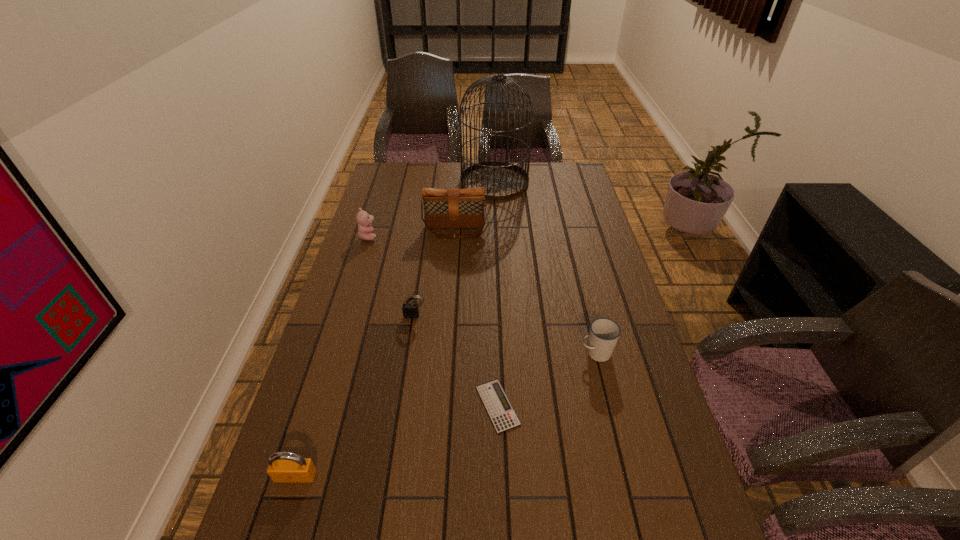
Image resolution: width=960 pixels, height=540 pixels. Identify the location of object present at the far edge. (501, 180).

Where is `teddy bear that is at the left edge`? The width and height of the screenshot is (960, 540). teddy bear that is at the left edge is located at coordinates (x=365, y=231).

Find the location of a particular element. padlock that is at the left edge is located at coordinates (284, 467).

Find the location of a particular element. The height and width of the screenshot is (540, 960). object that is positioned at the right edge is located at coordinates (604, 333).

The height and width of the screenshot is (540, 960). In order to click on vacant space at the far edge in this screenshot , I will do `click(436, 174)`.

Image resolution: width=960 pixels, height=540 pixels. In order to click on vacant space at the left edge of the desktop in this screenshot , I will do `click(343, 460)`.

You are a GUI agent. You are given a task and a screenshot of the screen. Output one action in this format:
    pyautogui.click(x=<x>, y=<y>)
    Task: Click on the vacant region at the right edge of the desktop
    This screenshot has height=540, width=960.
    Given the screenshot: What is the action you would take?
    pyautogui.click(x=598, y=255)

Where is `vacant area at the far left corner`? The height and width of the screenshot is (540, 960). vacant area at the far left corner is located at coordinates (406, 170).

This screenshot has height=540, width=960. In the image, there is a desktop. What are the coordinates of `vacant space at the far right corner` in the screenshot? It's located at (567, 164).

This screenshot has width=960, height=540. Identify the location of unoccupied position between the nearer padlock and the teddy bear. (332, 356).